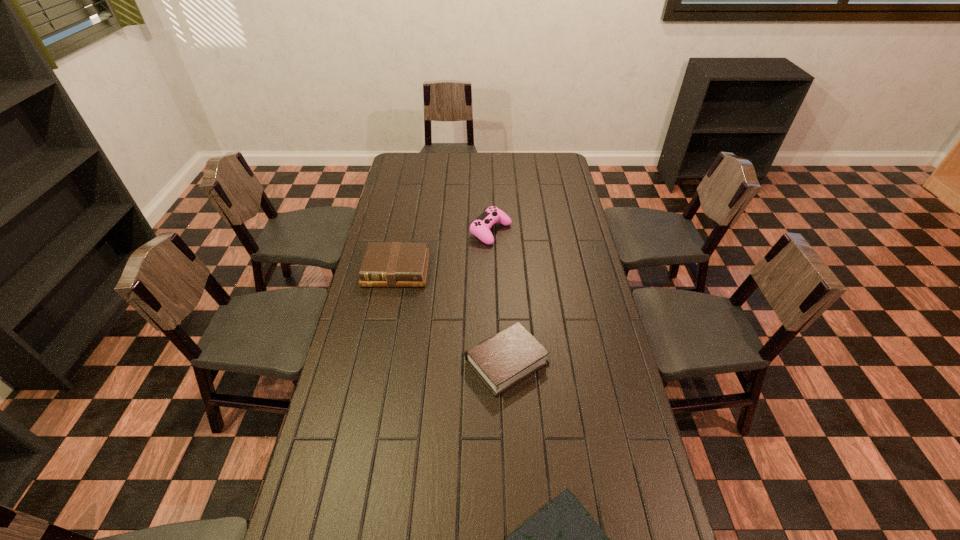
The width and height of the screenshot is (960, 540). Find the location of `the farthest object`. the farthest object is located at coordinates (481, 226).

Locate an element on the screen. This screenshot has width=960, height=540. the third nearest object is located at coordinates (386, 264).

Find the location of a particular element. The width and height of the screenshot is (960, 540). the farthest Bible is located at coordinates (386, 264).

This screenshot has height=540, width=960. Find the location of `the third farthest object`. the third farthest object is located at coordinates (501, 361).

Locate an element on the screen. vacant space situated on the left of the control is located at coordinates (446, 231).

This screenshot has height=540, width=960. What are the coordinates of `free space located on the spine side of the leftmost Bible` in the screenshot? It's located at (390, 302).

At what (x,y) coordinates should I click in order to perform the action: click on free space located 0.090m on the left of the second farthest Bible. Please return your answer as a coordinate pair (x, y). The width and height of the screenshot is (960, 540). Looking at the image, I should click on (437, 362).

I want to click on object at the left edge, so click(x=386, y=264).

Find the location of a particular element. blank space at the far edge of the desktop is located at coordinates (467, 176).

In order to click on free region at the left edge in this screenshot , I will do 382,366.